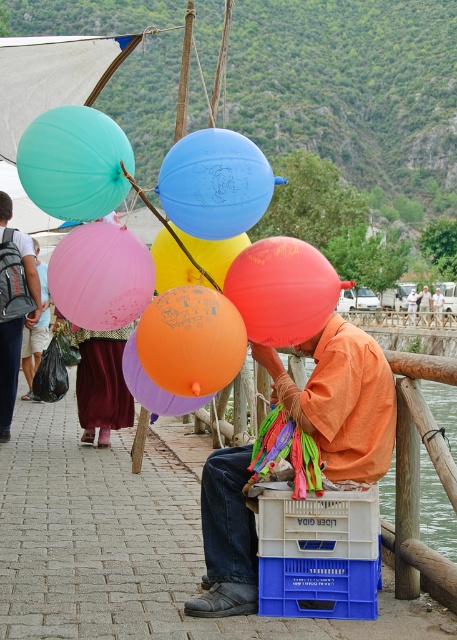
You are a customer at the balloon vendor and want to choose a balloon. You notice the orange matte balloon at center and the blue rubber balloon at center. Which balloon is closer to you?

The blue rubber balloon at center is closer to you because the orange matte balloon at center is behind it.

You are a customer looking at the balloons. Which balloon is more to the left between the pink rubber balloon at center and the translucent yellow balloon at center?

The pink rubber balloon at center is more to the left than the translucent yellow balloon at center.